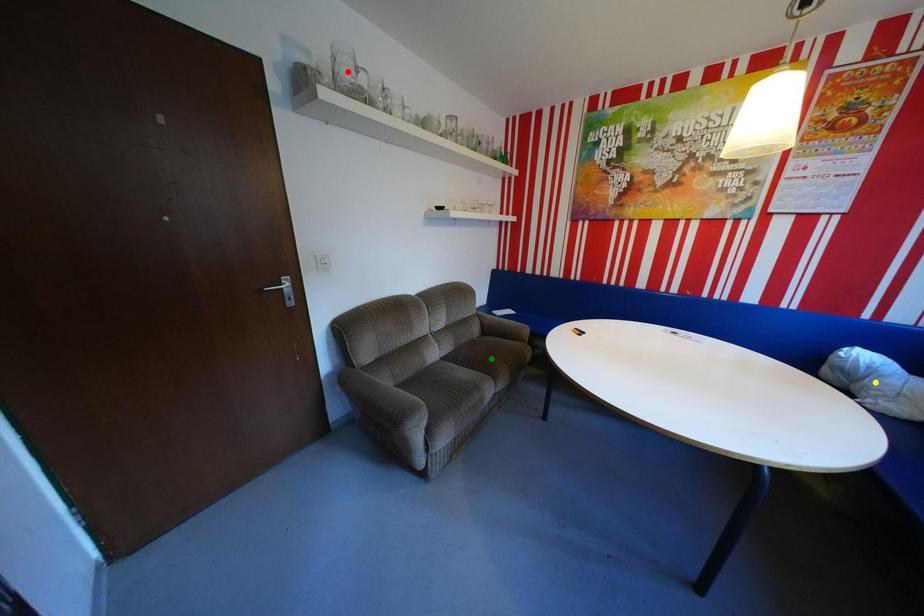
Order these from nearest to farthest:
A) green point
B) yellow point
C) red point

yellow point, red point, green point